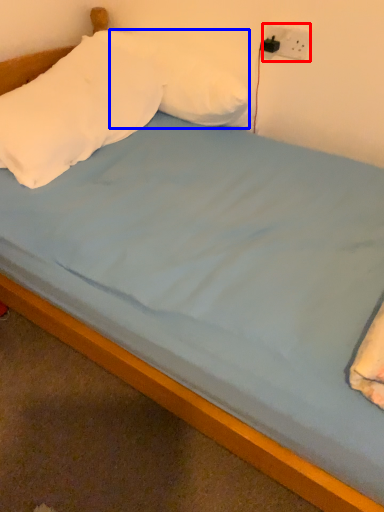
Question: Which object appears closest to the camera in this image, electric outlet (highlighted by a red box) or pillow (highlighted by a blue box)?

Choices:
 (A) electric outlet
 (B) pillow

Answer: (B)